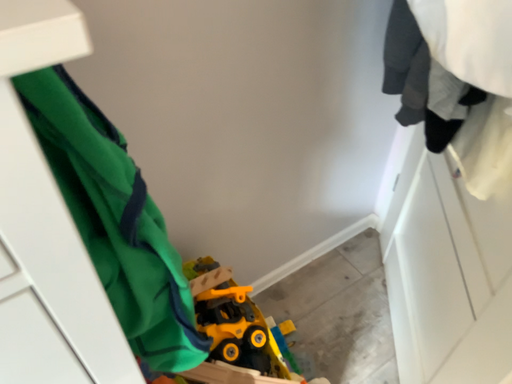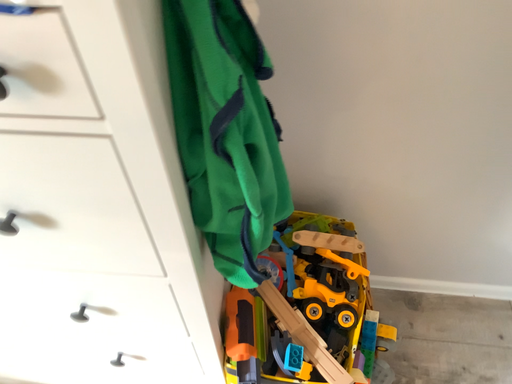
Question: Which way did the camera rotate in the video?

Choices:
 (A) rotated right
 (B) rotated left

Answer: (B)